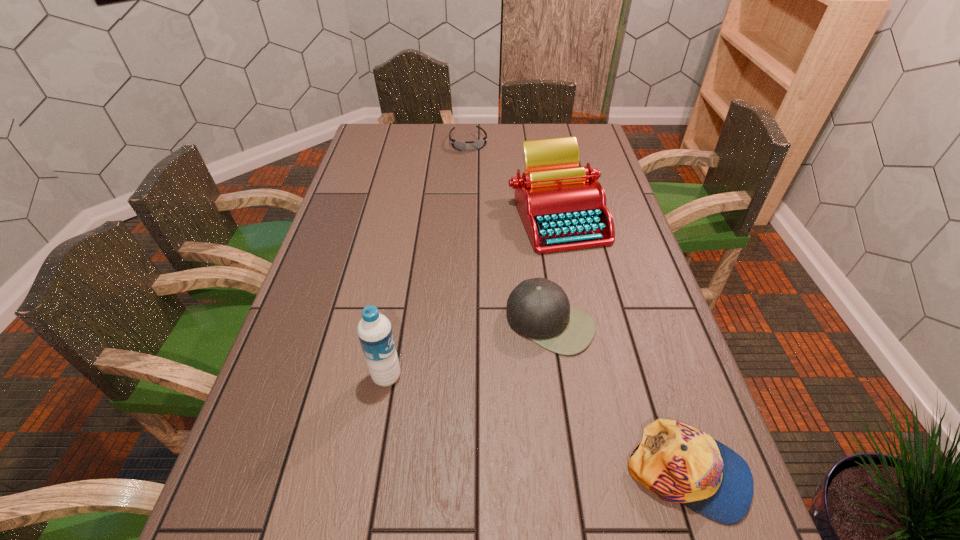
Identify the location of vacant space located on the typing side of the typewriter. (530, 305).

The width and height of the screenshot is (960, 540). In order to click on free spot located on the typing side of the typewriter in this screenshot , I will do `click(534, 294)`.

This screenshot has width=960, height=540. I want to click on vacant space located on the brim of the farther cap, so click(455, 466).

Where is `vacant position located on the brim of the farther cap`? vacant position located on the brim of the farther cap is located at coordinates coord(455,466).

You are a GUI agent. You are given a task and a screenshot of the screen. Output one action in this format:
    pyautogui.click(x=<x>, y=<y>)
    Task: Click on the free space located on the brim of the farther cap
    The height and width of the screenshot is (540, 960).
    Given the screenshot: What is the action you would take?
    pos(490,412)

Locate an element on the screen. vacant area situated on the lenses of the farthest object is located at coordinates (487, 210).

Where is `free spot located 0.220m on the lenses of the farthest object`? This screenshot has height=540, width=960. free spot located 0.220m on the lenses of the farthest object is located at coordinates (480, 185).

Where is `free space located 0.200m on the lenses of the farthest object`? This screenshot has width=960, height=540. free space located 0.200m on the lenses of the farthest object is located at coordinates (479, 182).

Locate an element on the screen. object at the far edge is located at coordinates (459, 145).

The width and height of the screenshot is (960, 540). What are the coordinates of `object that is at the near edge` in the screenshot? It's located at (677, 462).